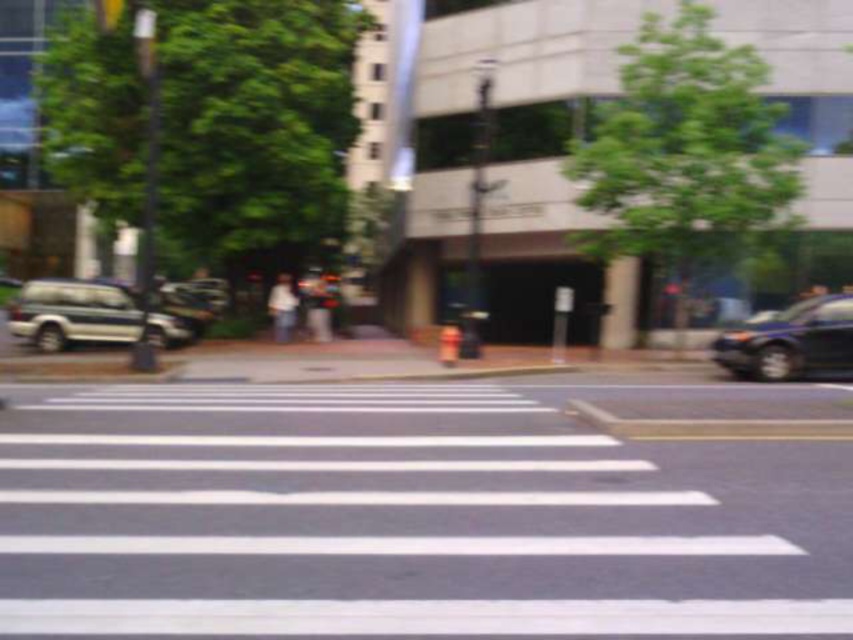
Question: Based on their relative distances, which object is nearer to the metallic silver suv at left?

Choices:
 (A) white asphalt crosswalk at center
 (B) shiny blue sedan at right

Answer: (B)

Question: Is white asphalt crosswalk at center thinner than shiny blue sedan at right?

Choices:
 (A) no
 (B) yes

Answer: (A)

Question: Is metallic silver suv at left to the right of shiny blue sedan at right from the viewer's perspective?

Choices:
 (A) no
 (B) yes

Answer: (A)

Question: Which of these objects is positioned closest to the white asphalt crosswalk at center?

Choices:
 (A) shiny blue sedan at right
 (B) metallic silver suv at left

Answer: (A)

Question: Is white asphalt crosswalk at center wider than metallic silver suv at left?

Choices:
 (A) no
 (B) yes

Answer: (B)

Question: Which object is closer to the camera taking this photo?

Choices:
 (A) metallic silver suv at left
 (B) white asphalt crosswalk at center
 (C) shiny blue sedan at right

Answer: (B)